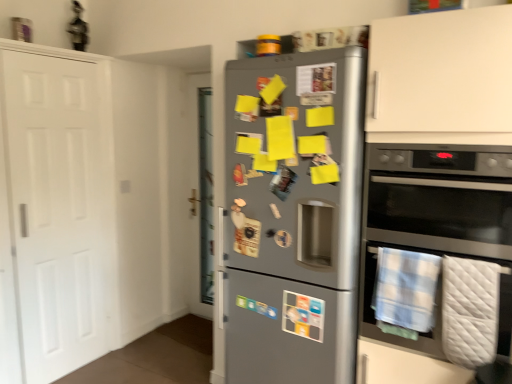
Question: Is blue plaid towel at lower right, which is counted as the first blanket, starting from the left, situated inside white quilted blanket at lower right, which ranks as the first blanket in right-to-left order, or outside?

Choices:
 (A) inside
 (B) outside

Answer: (B)

Question: Is point (399, 268) closer or farther from the camera than point (444, 329)?

Choices:
 (A) closer
 (B) farther

Answer: (B)

Question: Which of these objects is positioned closest to the blue plaid towel at lower right, which is counted as the second blanket, starting from the right?

Choices:
 (A) stainless steel oven at right
 (B) white matte door at left
 (C) satin silver fridge at center
 (D) white quilted blanket at lower right, which ranks as the first blanket in right-to-left order

Answer: (A)

Question: Which of these objects is positioned closest to the white matte door at left?

Choices:
 (A) blue plaid towel at lower right, which is counted as the second blanket, starting from the right
 (B) satin silver fridge at center
 (C) white quilted blanket at lower right, which is the second blanket from left to right
 (D) stainless steel oven at right

Answer: (B)